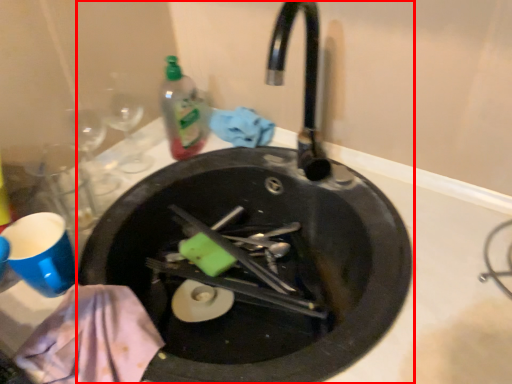
Question: From the image's perspective, where is sink (annotated by the red box) located relative to bottle?

Choices:
 (A) above
 (B) below

Answer: (B)